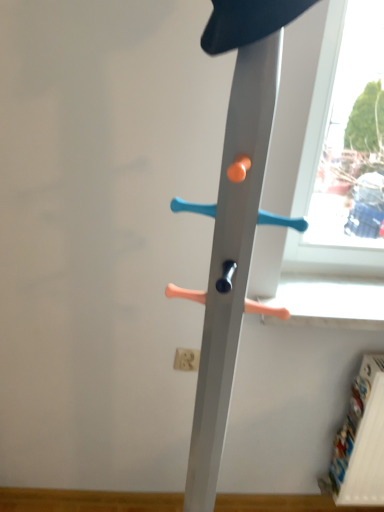
Question: Would you say metal coat rack at center is inside or outside white matte electric outlet at lower center?

Choices:
 (A) outside
 (B) inside

Answer: (A)

Question: From a real-world perspective, relative to white matte electric outlet at lower center, is metal coat rack at center vertically above or below?

Choices:
 (A) below
 (B) above

Answer: (B)

Question: Considering the positions of point (225, 280) and point (187, 358), is point (225, 280) closer or farther from the camera than point (187, 358)?

Choices:
 (A) closer
 (B) farther

Answer: (A)

Question: In terms of width, does white matte electric outlet at lower center look wider or thinner when compared to metal coat rack at center?

Choices:
 (A) wide
 (B) thin

Answer: (B)

Question: Is white matte electric outlet at lower center spatially inside metal coat rack at center, or outside of it?

Choices:
 (A) inside
 (B) outside

Answer: (B)

Question: Considering the positions of white matte electric outlet at lower center and metal coat rack at center in the image, is white matte electric outlet at lower center taller or shorter than metal coat rack at center?

Choices:
 (A) short
 (B) tall

Answer: (A)

Question: Is point (178, 352) positioned closer to the camera than point (263, 308)?

Choices:
 (A) farther
 (B) closer

Answer: (A)